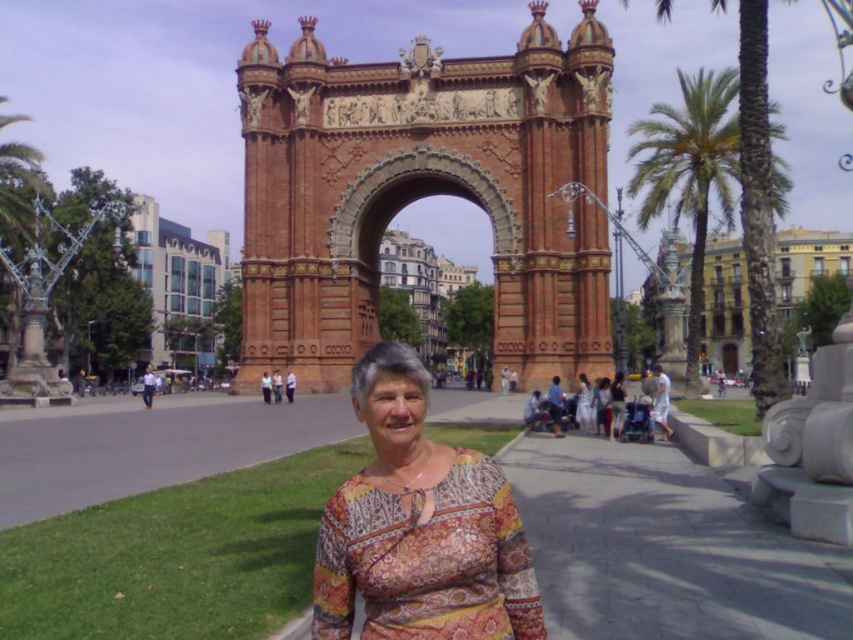
You are a tourist standing at the base of the archway in Barcelona. You see two points marked in the scene. The first point is at coordinates point (x=482, y=586) and the second is at point (x=613, y=428). Which point is closer to you?

Point (x=482, y=586) is in front of point (x=613, y=428), so it is closer to you.

You are a photographer trying to capture the brown brick arch at center and the printed fabric blouse at center in the same frame. Based on their positions, which object should you focus on first to ensure both are in sharp focus?

You should focus on the brown brick arch at center first because it is closer to the viewer than the printed fabric blouse at center, so adjusting focus from near to far will help both be in sharp focus.